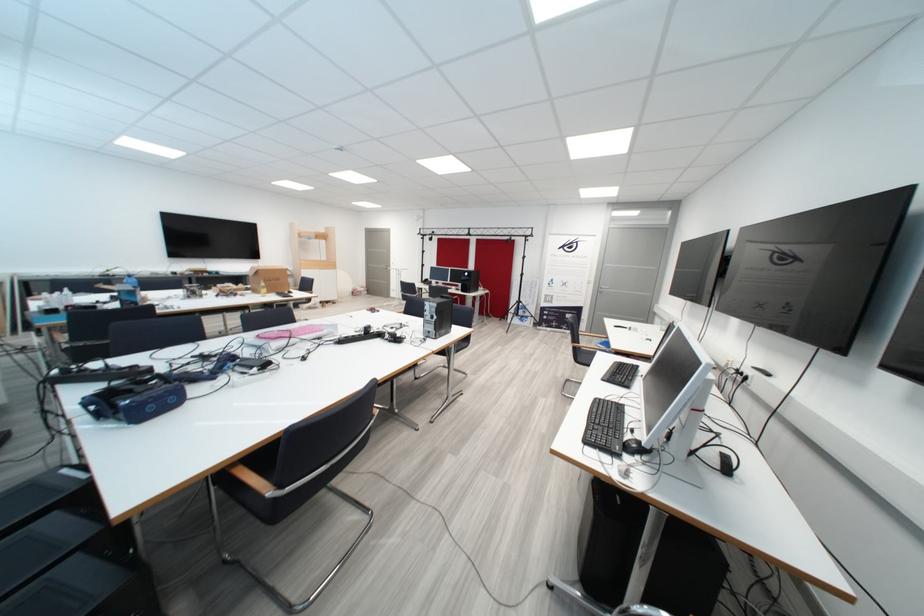
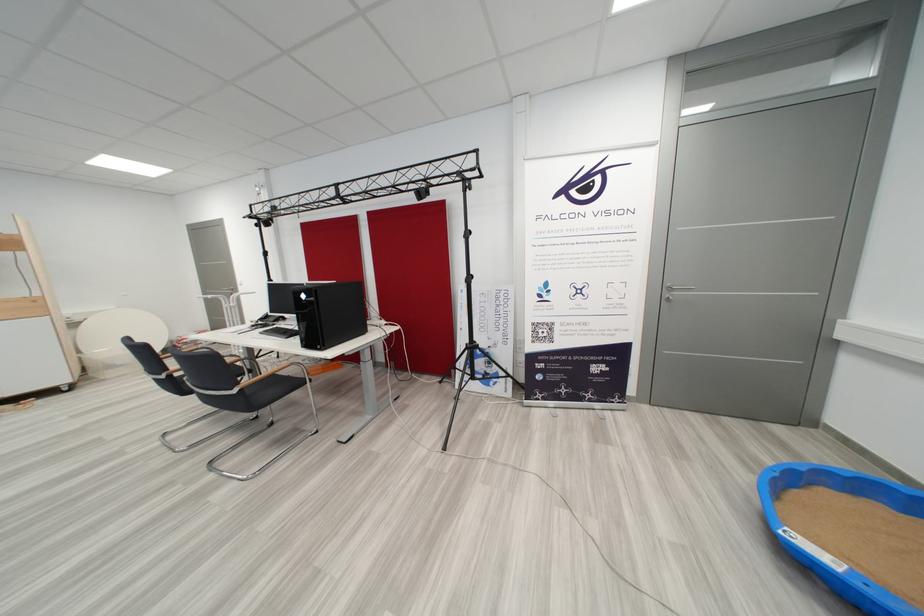
Question: Which direction would the cameraman need to move to produce the second image? Reply with the corresponding letter.

Choices:
 (A) Left
 (B) Right
 (C) Forward
 (D) Backward

Answer: (C)